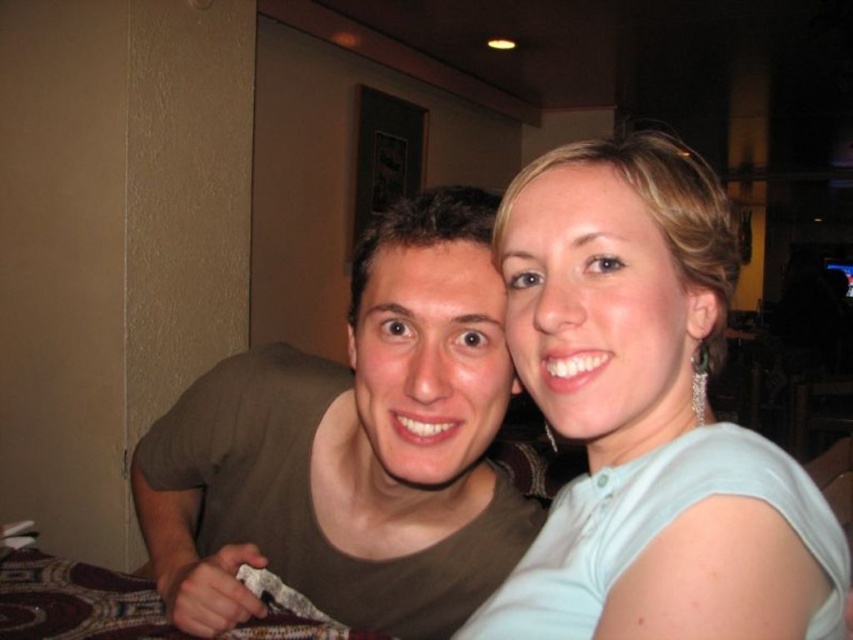
You are a photographer trying to capture a candid shot of the matte brown shirt at center without the light blue fabric at upper right blocking it. Is this possible given their positions?

The light blue fabric at upper right is in front of the matte brown shirt at center, so it would block the view. To capture the matte brown shirt at center without obstruction, you need to adjust your angle or position to avoid the light blue fabric at upper right.

From the picture: You are a waiter at a restaurant. You need to place a small dessert plate on the table. The dessert plate is 15 cm in diameter. The light blue fabric at upper right is 12 cm away from the matte brown shirt at center. Is there enough space between them to place the dessert plate?

The light blue fabric at upper right is 12 cm away from the matte brown shirt at center. Since the dessert plate is 15 cm in diameter, there isn